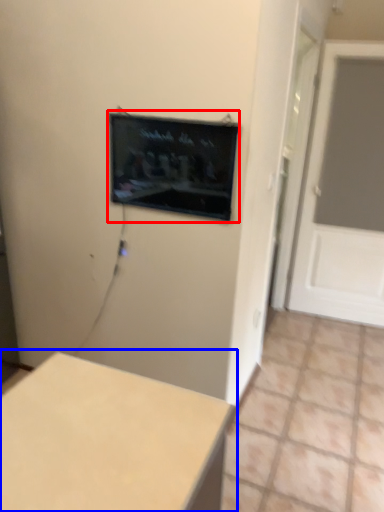
Question: Which point is further to the camera, computer screen (highlighted by a red box) or table (highlighted by a blue box)?

Choices:
 (A) computer screen
 (B) table

Answer: (A)